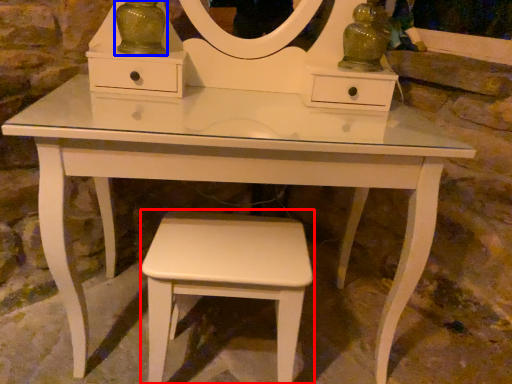
Question: Among these objects, which one is farthest to the camera, stool (highlighted by a red box) or glass vase (highlighted by a blue box)?

Choices:
 (A) stool
 (B) glass vase

Answer: (B)